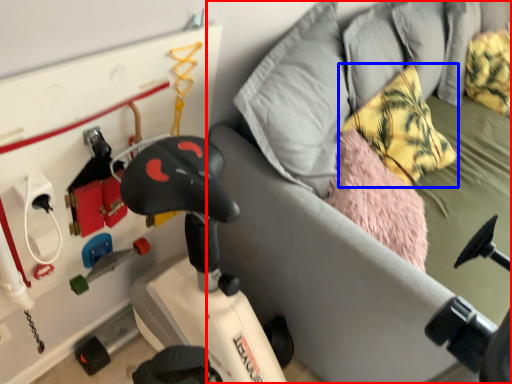
Question: Which object appears farthest to the camera in this image, furniture (highlighted by a red box) or pillow (highlighted by a blue box)?

Choices:
 (A) furniture
 (B) pillow

Answer: (B)